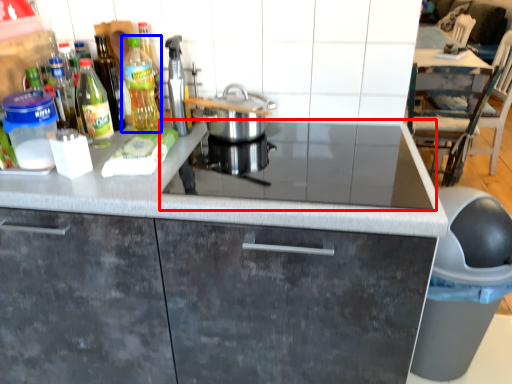
Question: Among these objects, which one is nearest to the camera, gas stove (highlighted by a red box) or kitchen appliance (highlighted by a blue box)?

Choices:
 (A) gas stove
 (B) kitchen appliance

Answer: (A)